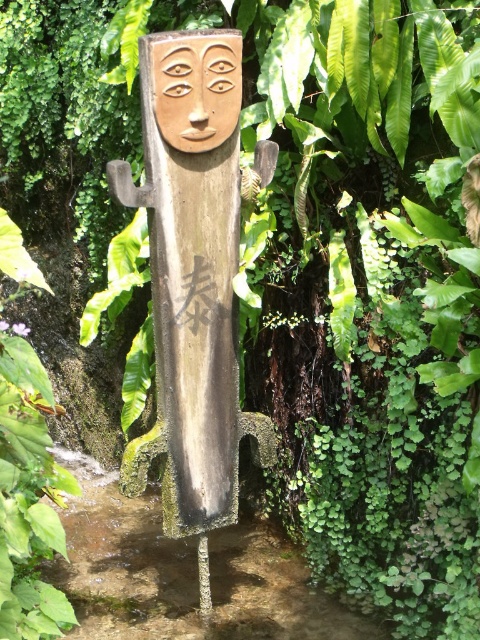
You are standing in front of the wooden sculpture and want to take a photo of it. The camera requires the subject to be centered at coordinates between 0.3 and 0.7 on both the x and y axes. Is the wooden carving at center positioned correctly for this requirement?

The wooden carving at center is located at coordinates 0.434 on the x and 0.404 on the y. Both values fall within the required range of 0.3 to 0.7, so it is correctly positioned for the camera.

You are an art student analyzing the wooden sculpture. You notice two elements, the wooden carving at center and the matte wood mask at upper center. Which one do you think is bigger in size?

The wooden carving at center is larger compared to matte wood mask at upper center.